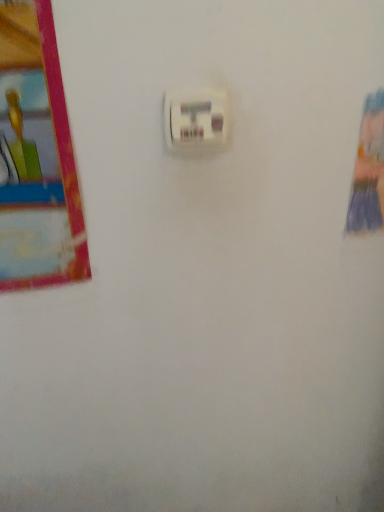
Question: Should I look upward or downward to see white plastic light switch at center?

Choices:
 (A) down
 (B) up

Answer: (B)